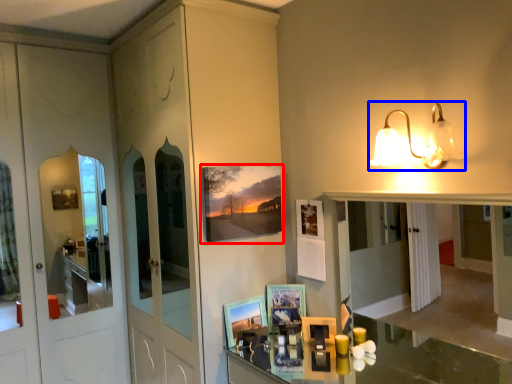
Question: Which object appears farthest to the camera in this image, picture frame (highlighted by a red box) or light fixture (highlighted by a blue box)?

Choices:
 (A) picture frame
 (B) light fixture

Answer: (A)